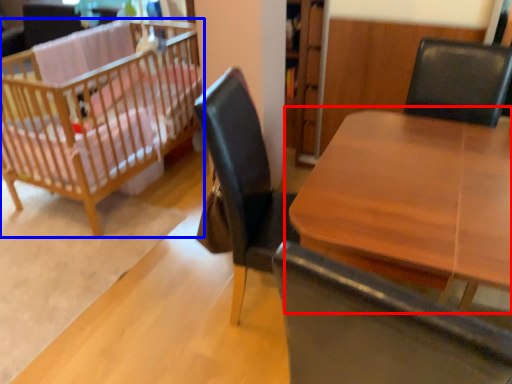
Question: Which point is closer to the camera, table (highlighted by a red box) or infant bed (highlighted by a blue box)?

Choices:
 (A) table
 (B) infant bed

Answer: (A)